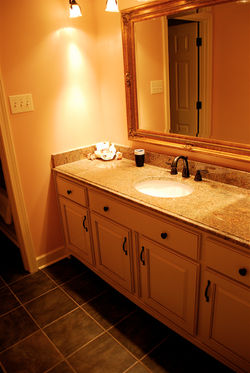
In order to click on light switch in this screenshot , I will do `click(13, 105)`, `click(21, 104)`, `click(29, 103)`, `click(152, 87)`, `click(156, 87)`, `click(159, 87)`.